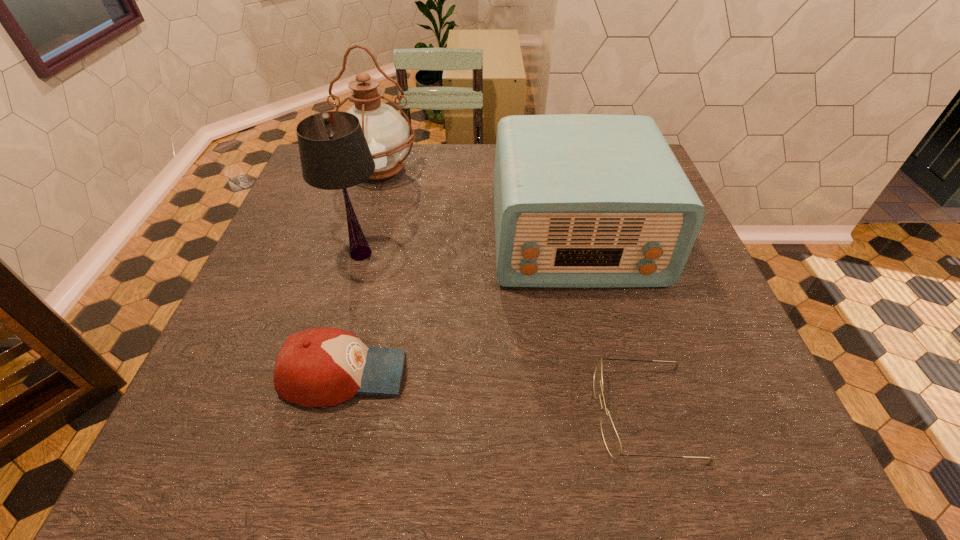
At what (x,y) coordinates should I click in order to perform the action: click on oil lamp. Please return your answer as a coordinate pair (x, y). Looking at the image, I should click on (387, 133).

Where is `lampshade`? The height and width of the screenshot is (540, 960). lampshade is located at coordinates (334, 154).

Locate an element on the screen. The height and width of the screenshot is (540, 960). radio receiver is located at coordinates (580, 200).

The image size is (960, 540). I want to click on the fourth tallest object, so click(x=318, y=367).

Find the location of a particular element. spectacles is located at coordinates (611, 439).

The width and height of the screenshot is (960, 540). Find the location of `blank space located 0.230m on the front of the oil lamp`. blank space located 0.230m on the front of the oil lamp is located at coordinates pos(358,248).

Locate an element on the screen. vacant space located on the front-facing side of the lampshade is located at coordinates (315, 422).

Identify the location of vacant space located 0.310m on the front panel of the radio receiver. Image resolution: width=960 pixels, height=540 pixels. (617, 424).

Identify the location of free space located on the front-facing side of the second shortest object. This screenshot has width=960, height=540. (605, 374).

Locate an element on the screen. vacant space located on the front-facing side of the spectacles is located at coordinates [x=539, y=413].